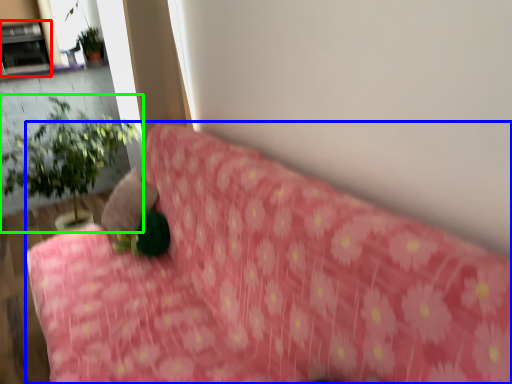
Question: Considering the real-world distances, which object is closest to fireplace (highlighted by a red box)? furniture (highlighted by a blue box) or houseplant (highlighted by a green box).

Choices:
 (A) furniture
 (B) houseplant

Answer: (B)